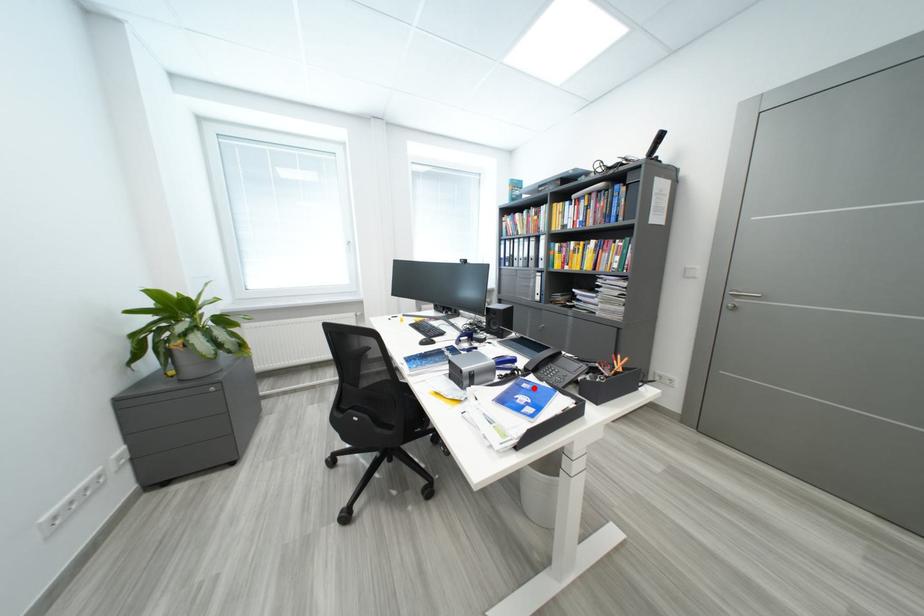
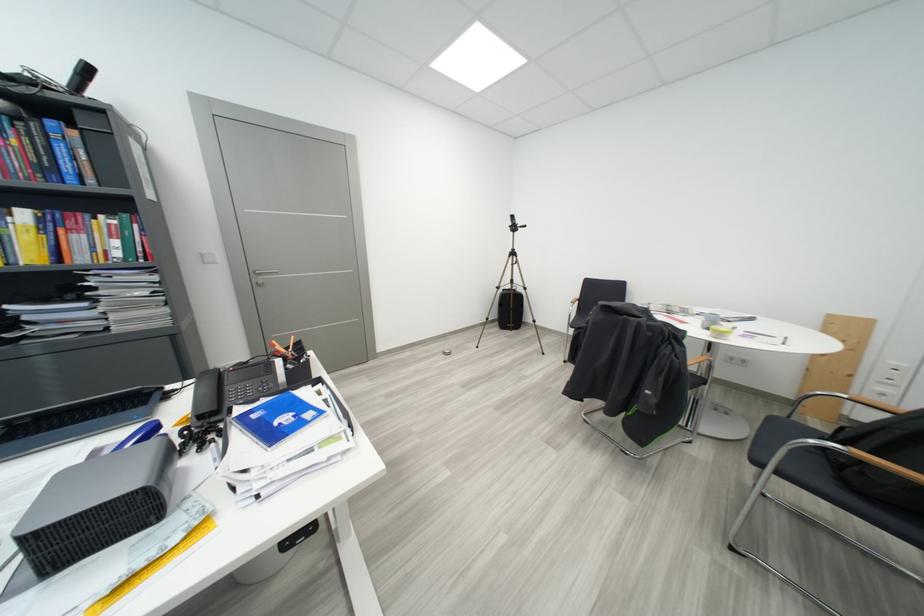
In the second image, find the point that corresponds to the highlighted location in the first image.

(263, 419)